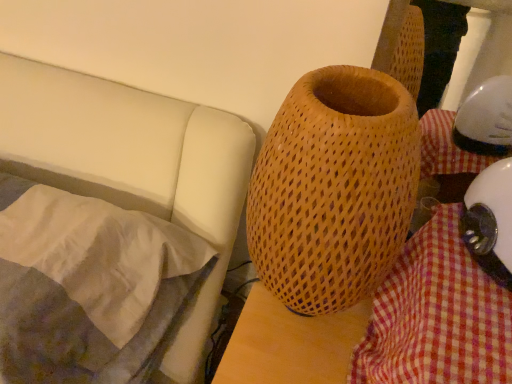
The image size is (512, 384). Describe the element at coordinates (437, 315) in the screenshot. I see `checkered fabric at lower right` at that location.

What is the approximate width of white glossy helmet at lower right?

15.34 centimeters.

In order to face white glossy helmet at lower right, should I rotate leftwards or rightwards?

You should rotate right by 32.902 degrees.

Where is `checkered fabric at lower right`? checkered fabric at lower right is located at coordinates (437, 315).

Considering their positions, is white glossy helmet at lower right located in front of or behind wooden textured vase at center?

Visually, white glossy helmet at lower right is located behind wooden textured vase at center.

From the picture: Could you tell me if white glossy helmet at lower right is facing wooden textured vase at center?

No, white glossy helmet at lower right does not turn towards wooden textured vase at center.

Measure the distance between white glossy helmet at lower right and wooden textured vase at center.

8.07 inches.

In the scene shown: From the image's perspective, which is below, white glossy helmet at lower right or wooden textured vase at center?

white glossy helmet at lower right is shown below in the image.

Find the location of a particular element. The height and width of the screenshot is (384, 512). table on the left of checkered fabric at lower right is located at coordinates [290, 344].

From a real-world perspective, does checkered fabric at lower right stand above wooden textured vase at center?

No, from a real-world perspective, checkered fabric at lower right is not on top of wooden textured vase at center.

From the image's perspective, is checkered fabric at lower right located above wooden textured vase at center?

No, from the image's perspective, checkered fabric at lower right is not over wooden textured vase at center.

Can you tell me how much checkered fabric at lower right and wooden textured vase at center differ in facing direction?

The facing directions of checkered fabric at lower right and wooden textured vase at center are 0.000347 degrees apart.

Does checkered fabric at lower right turn towards silky white pillow at left?

No, checkered fabric at lower right is not turned towards silky white pillow at left.

In the scene shown: Is checkered fabric at lower right surrounding silky white pillow at left?

No, silky white pillow at left is not surrounded by checkered fabric at lower right.

From the image's perspective, is checkered fabric at lower right under silky white pillow at left?

Yes.

How different are the orientations of checkered fabric at lower right and silky white pillow at left in degrees?

checkered fabric at lower right and silky white pillow at left are facing 2.27 degrees away from each other.

Can you confirm if wooden textured vase at center is taller than white glossy helmet at lower right?

Yes, wooden textured vase at center is taller than white glossy helmet at lower right.

In the scene shown: Is wooden textured vase at center placed right next to white glossy helmet at lower right?

No, wooden textured vase at center is not touching white glossy helmet at lower right.

Is wooden textured vase at center positioned before white glossy helmet at lower right?

Yes, wooden textured vase at center is closer to the viewer.

Is silky white pillow at left completely or partially outside of wooden textured vase at center?

silky white pillow at left lies outside wooden textured vase at center's area.

Does silky white pillow at left have a greater height compared to wooden textured vase at center?

In fact, silky white pillow at left may be shorter than wooden textured vase at center.

Looking at this image, are silky white pillow at left and wooden textured vase at center located far from each other?

silky white pillow at left is actually quite close to wooden textured vase at center.

From a real-world perspective, does wooden textured vase at center stand above checkered fabric at lower right?

Yes, from a real-world perspective, wooden textured vase at center is on top of checkered fabric at lower right.

Is wooden textured vase at center bigger or smaller than checkered fabric at lower right?

Considering their sizes, wooden textured vase at center takes up more space than checkered fabric at lower right.

Is wooden textured vase at center to the right of checkered fabric at lower right from the viewer's perspective?

No.

How different are the orientations of wooden textured vase at center and checkered fabric at lower right in degrees?

The facing directions of wooden textured vase at center and checkered fabric at lower right are 0.000347 degrees apart.

From a real-world perspective, is checkered fabric at lower right physically located above or below white glossy helmet at lower right?

checkered fabric at lower right is situated lower than white glossy helmet at lower right in the real world.

Can we say checkered fabric at lower right lies outside white glossy helmet at lower right?

checkered fabric at lower right lies outside white glossy helmet at lower right's area.

From the image's perspective, which is below, checkered fabric at lower right or white glossy helmet at lower right?

checkered fabric at lower right.

This screenshot has height=384, width=512. Find the location of `table lying above the white glossy helmet at lower right (from the image's perspective)`. table lying above the white glossy helmet at lower right (from the image's perspective) is located at coordinates (290, 344).

The image size is (512, 384). Identify the location of blanket that is below the wooden textured vase at center (from the image's perspective). click(x=437, y=315).

When comparing their distances from checkered fabric at lower right, does silky white pillow at left or wooden textured vase at center seem closer?

wooden textured vase at center lies closer to checkered fabric at lower right than the other object.

Which object lies nearer to the anchor point white glossy helmet at lower right, silky white pillow at left or wooden textured vase at center?

Among the two, wooden textured vase at center is located nearer to white glossy helmet at lower right.

Looking at the image, which one is located closer to wooden textured vase at center, white glossy helmet at lower right or silky white pillow at left?

Based on the image, white glossy helmet at lower right appears to be nearer to wooden textured vase at center.

Based on their spatial positions, is checkered fabric at lower right or white glossy helmet at lower right closer to wooden textured vase at center?

checkered fabric at lower right is positioned closer to the anchor wooden textured vase at center.

Estimate the real-world distances between objects in this image. Which object is closer to checkered fabric at lower right, wooden textured vase at center or white glossy helmet at lower right?

Among the two, white glossy helmet at lower right is located nearer to checkered fabric at lower right.

When comparing their distances from silky white pillow at left, does white glossy helmet at lower right or checkered fabric at lower right seem closer?

checkered fabric at lower right lies closer to silky white pillow at left than the other object.

From the image, which object appears to be nearer to checkered fabric at lower right, silky white pillow at left or white glossy helmet at lower right?

The object closer to checkered fabric at lower right is white glossy helmet at lower right.

Based on their spatial positions, is silky white pillow at left or white glossy helmet at lower right further from wooden textured vase at center?

The object further to wooden textured vase at center is silky white pillow at left.

The height and width of the screenshot is (384, 512). I want to click on table between silky white pillow at left and checkered fabric at lower right, so click(x=290, y=344).

Find the location of `table between silky white pillow at left and white glossy helmet at lower right`. table between silky white pillow at left and white glossy helmet at lower right is located at coordinates (290, 344).

Locate an element on the screen. The image size is (512, 384). blanket between wooden textured vase at center and white glossy helmet at lower right is located at coordinates (437, 315).

I want to click on blanket located between silky white pillow at left and white glossy helmet at lower right in the left-right direction, so click(x=437, y=315).